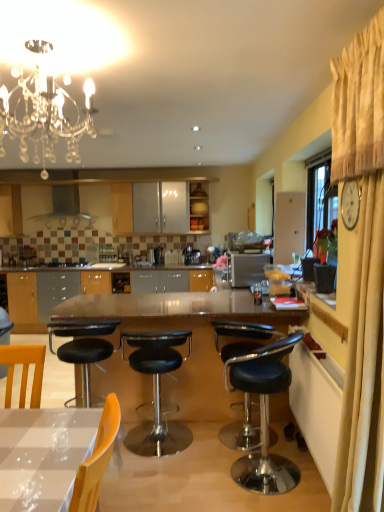
Locate an element on the screen. This screenshot has height=512, width=384. black leather stool at lower right, the second chair in the back-to-front sequence is located at coordinates (264, 415).

Describe the element at coordinates (264, 415) in the screenshot. I see `black leather stool at lower right, the first chair viewed from the right` at that location.

What do you see at coordinates (44, 117) in the screenshot?
I see `crystal glass chandelier at upper left` at bounding box center [44, 117].

You are a GUI agent. You are given a task and a screenshot of the screen. Output one action in this format:
    pyautogui.click(x=<x>, y=<y>)
    Task: Click on the beige fabric curtain at right
    
    Given the screenshot: What is the action you would take?
    pyautogui.click(x=362, y=268)

Is matte wood cabinet at center facing away from satin silver coffee machine at center?

No.

At what (x,y) coordinates should I click in order to perform the action: click on cabinetry on the right of satin silver coffee machine at center. Please return your answer as a coordinate pair (x, y). Image resolution: width=384 pixels, height=512 pixels. Looking at the image, I should click on (199, 209).

Considering the relative positions of matte wood cabinet at center and satin silver coffee machine at center in the image provided, is matte wood cabinet at center in front of satin silver coffee machine at center?

Yes.

From a real-world perspective, is matte wood cabinet at center on satin silver coffee machine at center?

Yes, from a real-world perspective, matte wood cabinet at center is above satin silver coffee machine at center.

From a real-world perspective, which object rests below the other?

From a 3D spatial view, transparent glass table at center is below.

Can you confirm if beige fabric curtain at right is smaller than transparent glass table at center?

Correct, beige fabric curtain at right occupies less space than transparent glass table at center.

Visually, is beige fabric curtain at right positioned to the left or to the right of transparent glass table at center?

In the image, beige fabric curtain at right appears on the right side of transparent glass table at center.

Is beige fabric curtain at right far from transparent glass table at center?

beige fabric curtain at right is positioned a significant distance from transparent glass table at center.

Is beige fabric curtain at right beside satin silver toaster at center?

beige fabric curtain at right is not next to satin silver toaster at center, and they're not touching.

The height and width of the screenshot is (512, 384). I want to click on curtain located below the satin silver toaster at center (from the image's perspective), so click(x=362, y=268).

Is beige fabric curtain at right oriented away from satin silver toaster at center?

That's not correct — beige fabric curtain at right is not looking away from satin silver toaster at center.

Considering their positions, is matte wood cabinet at center located in front of or behind black leather stool at lower right, the second chair in the back-to-front sequence?

In the image, matte wood cabinet at center appears behind black leather stool at lower right, the second chair in the back-to-front sequence.

What's the angular difference between matte wood cabinet at center and black leather stool at lower right, the first chair viewed from the right,'s facing directions?

The facing directions of matte wood cabinet at center and black leather stool at lower right, the first chair viewed from the right, are 180 degrees apart.

From the image's perspective, is matte wood cabinet at center on top of black leather stool at lower right, which is counted as the 2th chair, starting from the left?

Yes, from the image's perspective, matte wood cabinet at center is over black leather stool at lower right, which is counted as the 2th chair, starting from the left.

From a real-world perspective, relative to satin silver coffee machine at center, is black leather stool at center, the 2th chair positioned from the right, vertically above or below?

From a real-world perspective, black leather stool at center, the 2th chair positioned from the right, is physically below satin silver coffee machine at center.

How far apart are black leather stool at center, the 1th chair when ordered from back to front, and satin silver coffee machine at center?

They are 9.78 feet apart.

In the scene shown: From the image's perspective, is black leather stool at center, the 2th chair positioned from the right, over satin silver coffee machine at center?

No.

Considering the relative positions of black leather stool at center, the 1th chair when ordered from back to front, and satin silver coffee machine at center in the image provided, is black leather stool at center, the 1th chair when ordered from back to front, in front of satin silver coffee machine at center?

That is True.

Which object is thinner, satin silver toaster at center or satin silver coffee machine at center?

Thinner between the two is satin silver coffee machine at center.

In terms of size, does satin silver toaster at center appear bigger or smaller than satin silver coffee machine at center?

satin silver toaster at center is bigger than satin silver coffee machine at center.

Is satin silver toaster at center not within satin silver coffee machine at center?

satin silver toaster at center is positioned outside satin silver coffee machine at center.

Who is shorter, satin silver toaster at center or satin silver coffee machine at center?

With less height is satin silver coffee machine at center.

Is black leather stool at center, which is the second chair from front to back, a part of matte wood cabinet at center?

No, black leather stool at center, which is the second chair from front to back, is located outside of matte wood cabinet at center.

Is point (195, 207) positioned after point (136, 438)?

That is True.

Looking at this image, considering the sizes of objects matte wood cabinet at center and black leather stool at center, the 1th chair when ordered from back to front, in the image provided, who is wider, matte wood cabinet at center or black leather stool at center, the 1th chair when ordered from back to front,?

Wider between the two is black leather stool at center, the 1th chair when ordered from back to front.

Does matte wood cabinet at center have a larger size compared to black leather stool at center, the 1th chair when ordered from back to front?

Actually, matte wood cabinet at center might be smaller than black leather stool at center, the 1th chair when ordered from back to front.

The image size is (384, 512). I want to click on coffee machine below the matte wood cabinet at center (from the image's perspective), so click(191, 256).

At what (x,y) coordinates should I click in order to perform the action: click on table located underneath the beige fabric curtain at right (from a real-world perspective). Please return your answer as a coordinate pair (x, y). The image size is (384, 512). Looking at the image, I should click on (184, 329).

Estimate the real-world distances between objects in this image. Which object is further from satin silver range hood at upper center, black leather stool at center, positioned as the first chair in left-to-right order, or black leather stool at lower right, the first chair viewed from the right?

black leather stool at lower right, the first chair viewed from the right, is further to satin silver range hood at upper center.

Which object lies further to the anchor point satin silver coffee machine at center, transparent glass table at center or satin silver toaster at center?

The object further to satin silver coffee machine at center is transparent glass table at center.

Estimate the real-world distances between objects in this image. Which object is closer to satin silver toaster at center, crystal glass chandelier at upper left or satin silver coffee machine at center?

satin silver coffee machine at center.

Based on the photo, based on their spatial positions, is satin silver range hood at upper center or black leather stool at lower right, the first chair viewed from the right, further from crystal glass chandelier at upper left?

satin silver range hood at upper center.

Based on their spatial positions, is satin silver coffee machine at center or crystal glass chandelier at upper left closer to satin silver range hood at upper center?

Based on the image, satin silver coffee machine at center appears to be nearer to satin silver range hood at upper center.

When comparing their distances from black leather stool at lower right, the second chair in the back-to-front sequence, does black leather stool at center, which is the second chair from front to back, or satin silver toaster at center seem closer?

Based on the image, black leather stool at center, which is the second chair from front to back, appears to be nearer to black leather stool at lower right, the second chair in the back-to-front sequence.

Estimate the real-world distances between objects in this image. Which object is further from black leather stool at center, the 2th chair positioned from the right, satin silver range hood at upper center or beige fabric curtain at right?

satin silver range hood at upper center is positioned further to the anchor black leather stool at center, the 2th chair positioned from the right.

Based on the photo, considering their positions, is beige fabric curtain at right positioned further to transparent glass table at center than satin silver coffee machine at center?

The object further to transparent glass table at center is satin silver coffee machine at center.

Where is `cabinetry between crystal glass chandelier at upper left and satin silver range hood at upper center from front to back`? cabinetry between crystal glass chandelier at upper left and satin silver range hood at upper center from front to back is located at coordinates (199, 209).

Locate an element on the screen. This screenshot has height=512, width=384. cabinetry between black leather stool at lower right, which is counted as the first chair, starting from the front, and satin silver range hood at upper center from front to back is located at coordinates (199, 209).

Locate an element on the screen. This screenshot has width=384, height=512. appliance between black leather stool at center, which is the second chair from front to back, and satin silver coffee machine at center, along the z-axis is located at coordinates (248, 268).

The height and width of the screenshot is (512, 384). Find the location of `table between beige fabric curtain at right and matte wood cabinet at center along the z-axis`. table between beige fabric curtain at right and matte wood cabinet at center along the z-axis is located at coordinates (184, 329).